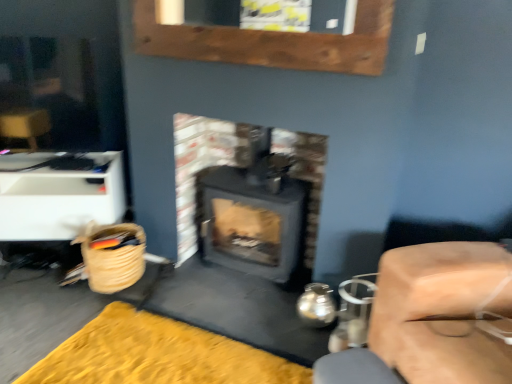
Question: Is point (126, 339) positioned closer to the camera than point (12, 200)?

Choices:
 (A) farther
 (B) closer

Answer: (B)

Question: Is yellow plush rug at lower left spatially inside white plastic drawer at left, arranged as the second furniture when viewed from the right, or outside of it?

Choices:
 (A) inside
 (B) outside

Answer: (B)

Question: Based on their relative distances, which object is farther from the matte black wood burning stove at center?

Choices:
 (A) white plastic drawer at left, which is counted as the first furniture, starting from the left
 (B) woven straw basket at lower left
 (C) yellow plush rug at lower left
 (D) smooth beige cushion at right, acting as the 1th furniture starting from the right

Answer: (D)

Question: Estimate the real-world distances between objects in this image. Which object is farther from the woven straw basket at lower left?

Choices:
 (A) yellow plush rug at lower left
 (B) smooth beige cushion at right, which is the first furniture in front-to-back order
 (C) white plastic drawer at left, acting as the 1th furniture starting from the back
 (D) matte black wood burning stove at center

Answer: (B)